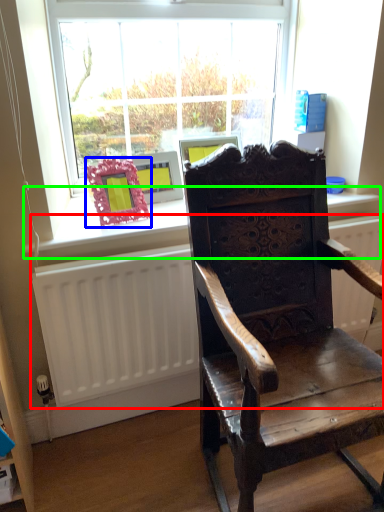
Question: Based on their relative distances, which object is nearer to radiator (highlighted by a red box)? Choose from picture frame (highlighted by a blue box) and window sill (highlighted by a green box).

Choices:
 (A) picture frame
 (B) window sill

Answer: (B)